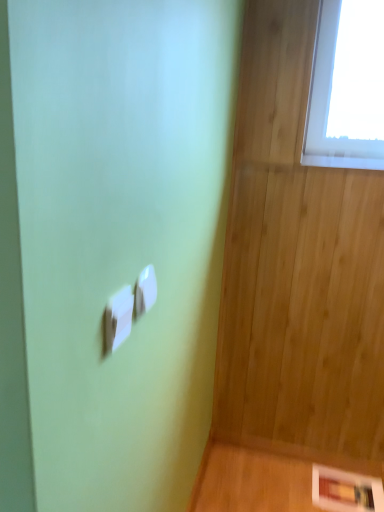
Question: Based on their positions, is white plastic light switch at center, placed as the 1th light switch when sorted from front to back, located to the left or right of white glossy picture frame at lower right?

Choices:
 (A) right
 (B) left

Answer: (B)

Question: Would you say white plastic light switch at center, the 1th light switch when ordered from left to right, is inside or outside white glossy picture frame at lower right?

Choices:
 (A) inside
 (B) outside

Answer: (B)

Question: Considering the real-world distances, which object is closest to the white glossy picture frame at lower right?

Choices:
 (A) white plastic light switch at center, which is counted as the first light switch, starting from the back
 (B) white plastic light switch at center, the second light switch when ordered from right to left

Answer: (A)

Question: Which object is positioned farthest from the white plastic light switch at center, the 2th light switch positioned from the back?

Choices:
 (A) white plastic light switch at center, which is the 2th light switch from front to back
 (B) white glossy picture frame at lower right

Answer: (B)